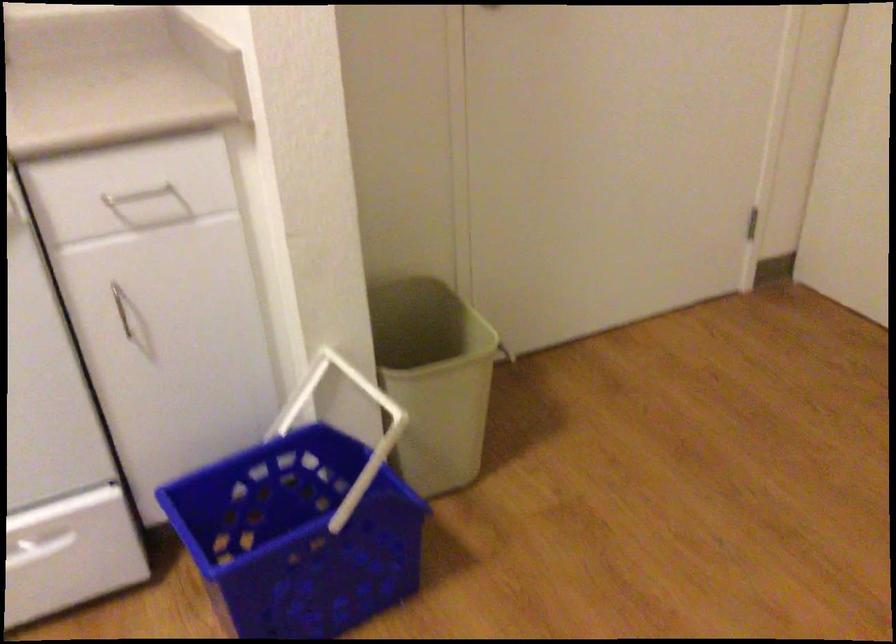
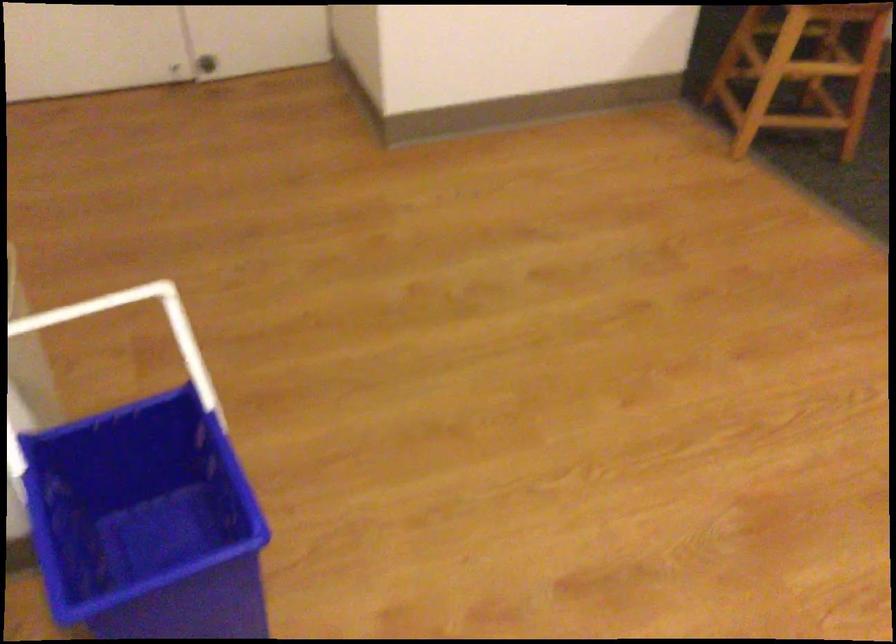
In the second image, find the point that corresponds to pixel 367 383 in the first image.

(58, 316)